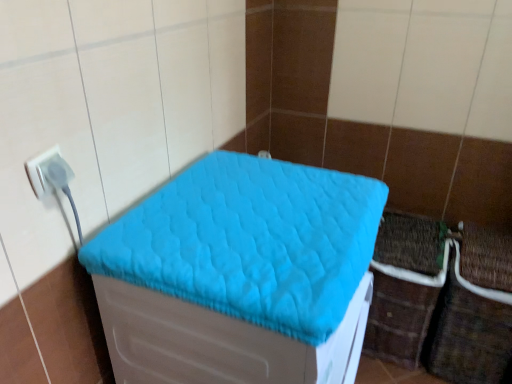
Question: From the image's perspective, is brown woven crate at lower right on top of turquoise quilted cushion at center?

Choices:
 (A) no
 (B) yes

Answer: (A)

Question: Is brown woven crate at lower right bigger than turquoise quilted cushion at center?

Choices:
 (A) yes
 (B) no

Answer: (A)

Question: Considering the relative positions of brown woven crate at lower right and turquoise quilted cushion at center in the image provided, is brown woven crate at lower right to the right of turquoise quilted cushion at center from the viewer's perspective?

Choices:
 (A) no
 (B) yes

Answer: (B)

Question: Is brown woven crate at lower right oriented away from turquoise quilted cushion at center?

Choices:
 (A) yes
 (B) no

Answer: (B)

Question: Can you confirm if brown woven crate at lower right is wider than turquoise quilted cushion at center?

Choices:
 (A) yes
 (B) no

Answer: (B)

Question: Is there a large distance between brown woven crate at lower right and turquoise quilted cushion at center?

Choices:
 (A) no
 (B) yes

Answer: (A)

Question: Is the position of turquoise quilted cushion at center more distant than that of white plastic plug at left?

Choices:
 (A) no
 (B) yes

Answer: (A)

Question: Is turquoise quilted cushion at center bigger than white plastic plug at left?

Choices:
 (A) yes
 (B) no

Answer: (A)

Question: Is turquoise quilted cushion at center outside of white plastic plug at left?

Choices:
 (A) yes
 (B) no

Answer: (A)

Question: Can you confirm if turquoise quilted cushion at center is smaller than white plastic plug at left?

Choices:
 (A) yes
 (B) no

Answer: (B)

Question: Considering the relative sizes of turquoise quilted cushion at center and white plastic plug at left in the image provided, is turquoise quilted cushion at center taller than white plastic plug at left?

Choices:
 (A) no
 (B) yes

Answer: (A)

Question: Considering the relative positions of turquoise quilted cushion at center and white plastic plug at left in the image provided, is turquoise quilted cushion at center in front of white plastic plug at left?

Choices:
 (A) yes
 (B) no

Answer: (A)

Question: Is the position of white plastic plug at left more distant than that of brown woven crate at lower right?

Choices:
 (A) yes
 (B) no

Answer: (B)